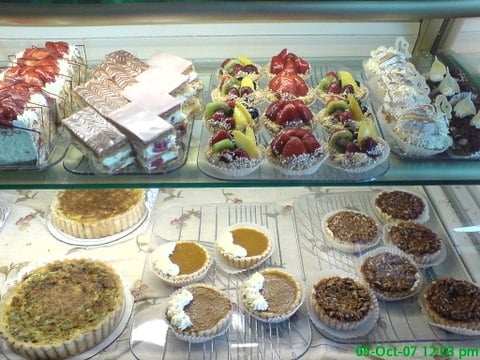
Find the location of a particular element. The height and width of the screenshot is (360, 480). glass shelf is located at coordinates (191, 179), (55, 180), (440, 175).